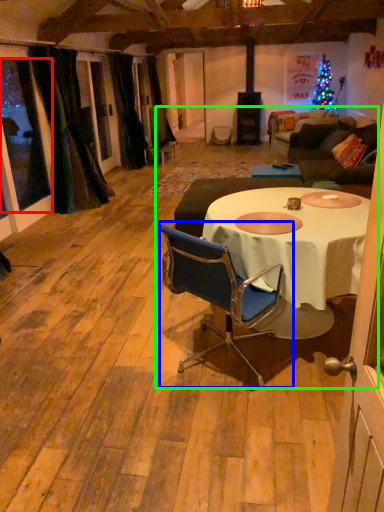
Question: Which is nearer to the window screen (highlighted by a red box)? chair (highlighted by a blue box) or dinner party (highlighted by a green box).

Choices:
 (A) chair
 (B) dinner party

Answer: (B)